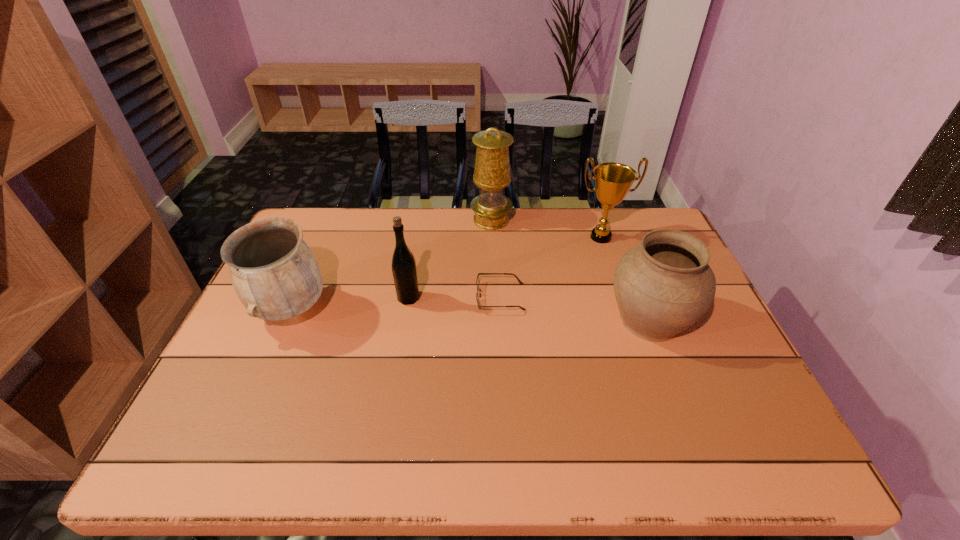
Locate an element on the screen. The height and width of the screenshot is (540, 960). vacant space located on the right of the left urn is located at coordinates (398, 309).

At what (x,y) coordinates should I click in order to perform the action: click on free space located 0.250m on the front-facing side of the shortest object. Please return your answer as a coordinate pair (x, y). The width and height of the screenshot is (960, 540). Looking at the image, I should click on (387, 297).

Identify the location of vacant region located 0.260m on the front-facing side of the shortest object. The image size is (960, 540). (384, 297).

In order to click on free spot located on the front-facing side of the shortest object in this screenshot , I will do `click(447, 297)`.

This screenshot has height=540, width=960. In order to click on oil lamp at the far edge in this screenshot , I will do `click(492, 167)`.

Identify the location of award present at the far edge. (612, 180).

Where is `object situated at the left edge`? This screenshot has height=540, width=960. object situated at the left edge is located at coordinates (274, 273).

Find the location of a particular element. The width and height of the screenshot is (960, 540). award located at the right edge is located at coordinates (612, 180).

What are the coordinates of `urn that is at the right edge` in the screenshot? It's located at (664, 285).

In order to click on object located at the far right corner in this screenshot , I will do `click(612, 180)`.